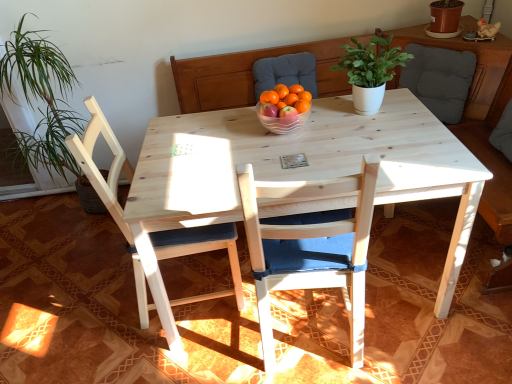
Question: Is dark gray fabric cushion at upper right behind orange matte at center, which is the first tangerine in left-to-right order?

Choices:
 (A) no
 (B) yes

Answer: (B)

Question: Is dark gray fabric cushion at upper right to the left of orange matte at center, which is the first tangerine in left-to-right order, from the viewer's perspective?

Choices:
 (A) no
 (B) yes

Answer: (A)

Question: Can you confirm if dark gray fabric cushion at upper right is smaller than orange matte at center, which is the first tangerine in left-to-right order?

Choices:
 (A) no
 (B) yes

Answer: (A)

Question: From a real-world perspective, is dark gray fabric cushion at upper right below orange matte at center, which is the 2th tangerine from right to left?

Choices:
 (A) yes
 (B) no

Answer: (A)

Question: From the image's perspective, would you say dark gray fabric cushion at upper right is positioned over orange matte at center, which is the first tangerine in left-to-right order?

Choices:
 (A) yes
 (B) no

Answer: (A)

Question: Considering the relative sizes of dark gray fabric cushion at upper right and orange matte at center, which is the 2th tangerine from right to left, in the image provided, is dark gray fabric cushion at upper right wider than orange matte at center, which is the 2th tangerine from right to left,?

Choices:
 (A) no
 (B) yes

Answer: (B)

Question: Are natural wood chair at left, positioned as the first chair in left-to-right order, and white matte plant pot at center far apart?

Choices:
 (A) no
 (B) yes

Answer: (A)

Question: Are natural wood chair at left, positioned as the first chair in left-to-right order, and white matte plant pot at center making contact?

Choices:
 (A) yes
 (B) no

Answer: (B)

Question: From a real-world perspective, does natural wood chair at left, acting as the second chair starting from the right, stand above white matte plant pot at center?

Choices:
 (A) no
 (B) yes

Answer: (A)

Question: Is natural wood chair at left, acting as the second chair starting from the right, outside white matte plant pot at center?

Choices:
 (A) no
 (B) yes

Answer: (B)

Question: Could you tell me if natural wood chair at left, positioned as the first chair in left-to-right order, is facing white matte plant pot at center?

Choices:
 (A) yes
 (B) no

Answer: (A)

Question: Is natural wood chair at left, positioned as the first chair in left-to-right order, turned away from white matte plant pot at center?

Choices:
 (A) no
 (B) yes

Answer: (A)

Question: Is clear plastic bowl at center wider than orange matte at center, which is the 2th tangerine from right to left?

Choices:
 (A) yes
 (B) no

Answer: (A)